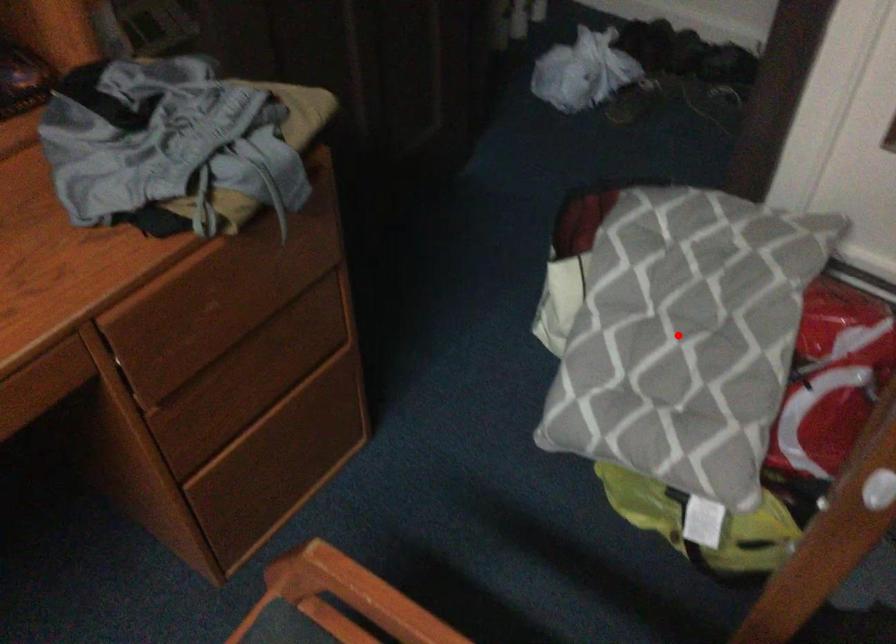
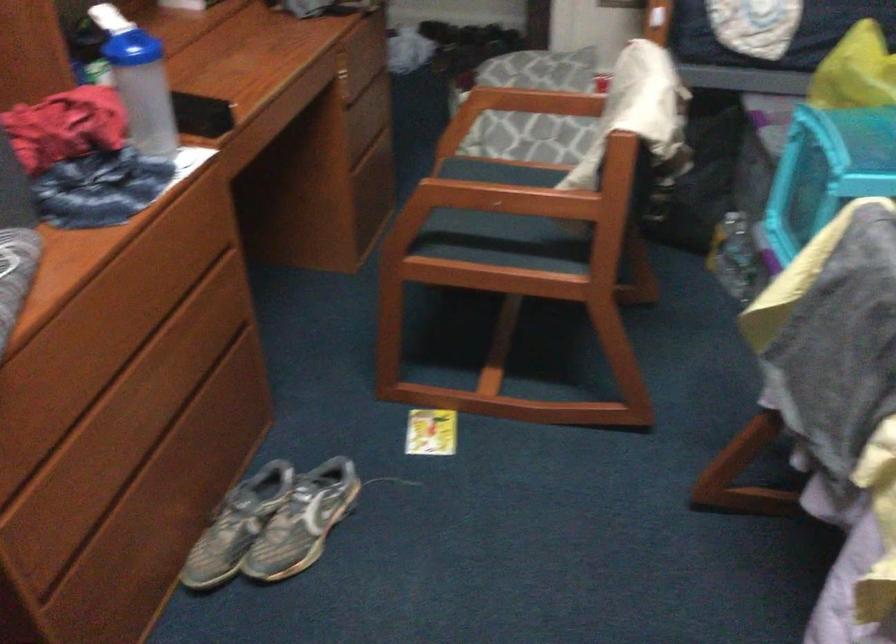
Question: I am providing you with two images of the same scene from different viewpoints. A red point is marked on the first image. Can you still see the location of the red point in image 2?

Choices:
 (A) Yes
 (B) No

Answer: (B)